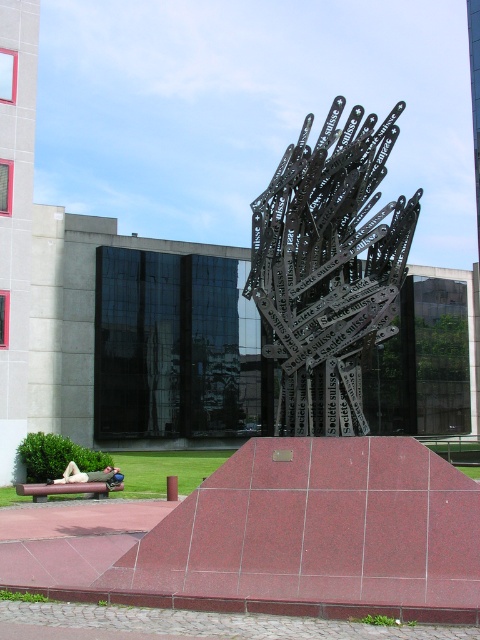
Is metallic chainsaw blades at center taller than light beige fabric at lower left?

Indeed, metallic chainsaw blades at center has a greater height compared to light beige fabric at lower left.

Who is more distant from viewer, (367, 168) or (67, 468)?

The point (67, 468) is more distant.

Identify the location of metallic chainsaw blades at center. The height and width of the screenshot is (640, 480). point(328,268).

Locate an element on the screen. This screenshot has width=480, height=640. metallic chainsaw blades at center is located at coordinates (328, 268).